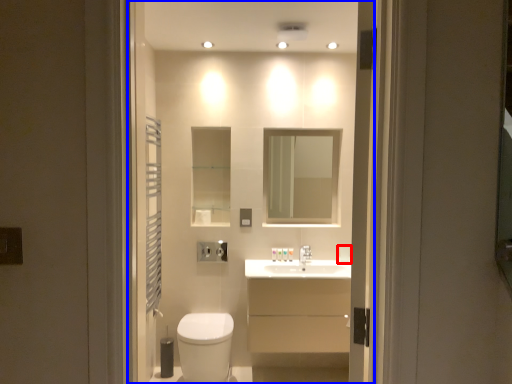
Question: Which object appears closest to the camera in this image, toilet paper (highlighted by a red box) or residence (highlighted by a blue box)?

Choices:
 (A) toilet paper
 (B) residence

Answer: (B)